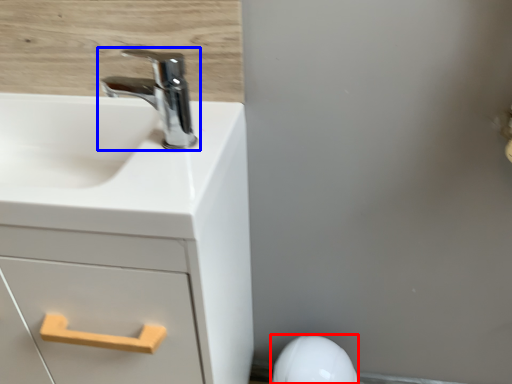
Question: Among these objects, which one is nearest to the camera, porcelain (highlighted by a red box) or tap (highlighted by a blue box)?

Choices:
 (A) porcelain
 (B) tap

Answer: (B)